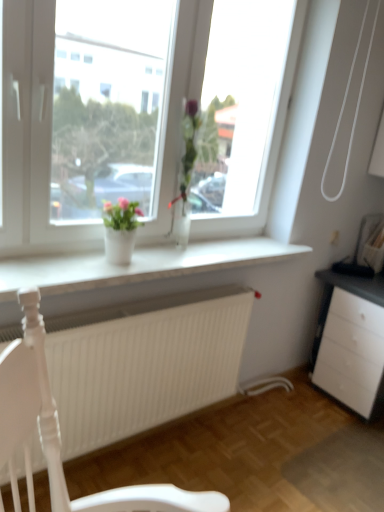
Question: Is white smooth window sill at center taller or shorter than white glossy vase at center, the 2th houseplant from the right?

Choices:
 (A) short
 (B) tall

Answer: (A)

Question: From the image's perspective, relative to white glossy vase at center, the 2th houseplant from the right, is white smooth window sill at center above or below?

Choices:
 (A) below
 (B) above

Answer: (A)

Question: Which of these objects is positioned closest to the white glass vase at center?

Choices:
 (A) white smooth window sill at center
 (B) white glossy vase at center, the 1th houseplant from the left
 (C) clear glass vase at center, which is the first houseplant from right to left
 (D) white matte radiator at lower center

Answer: (A)

Question: Which of these objects is positioned closest to the white glossy vase at center, the 2th houseplant from the right?

Choices:
 (A) white glass vase at center
 (B) white matte radiator at lower center
 (C) clear glass vase at center, which is the first houseplant from right to left
 (D) white smooth window sill at center

Answer: (D)